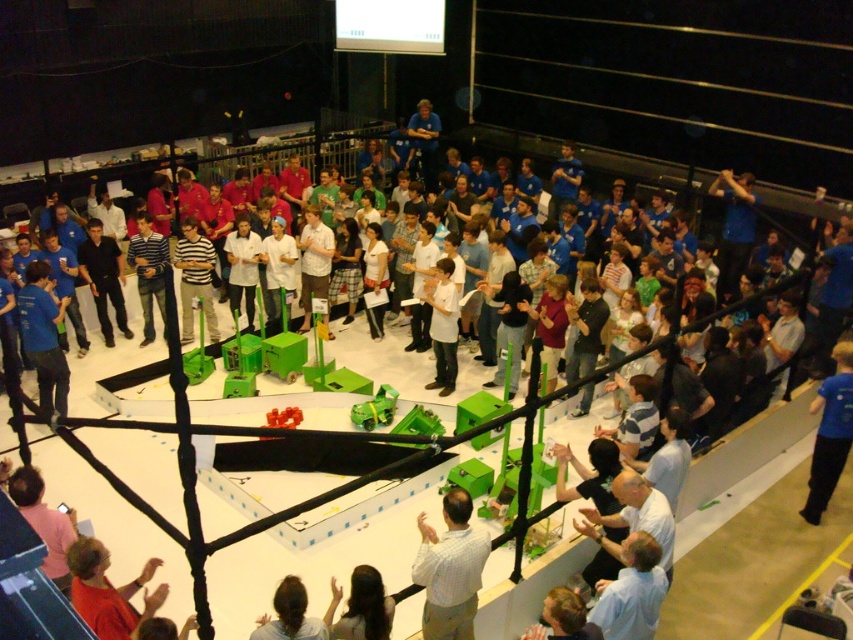
You are a photographer at the robotics competition and need to capture a photo of the dark blue shirt at center and the light blue shirt at lower right. From the perspective of someone standing behind the arena, which shirt is positioned lower in the frame?

The light blue shirt at lower right is positioned below the dark blue shirt at center, so from the photographer standing behind the arena, the light blue shirt at lower right will appear lower in the frame.